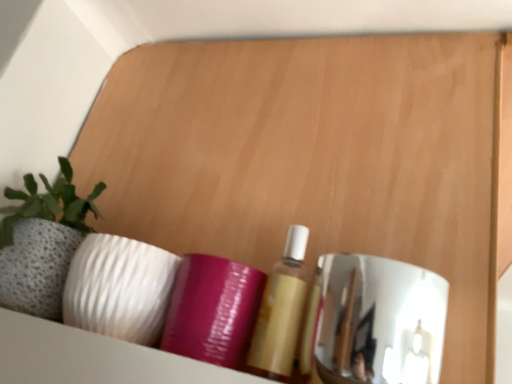
Question: Is matte gold bottle at center, marked as the second toiletry in a left-to-right arrangement, wider or thinner than purple glossy tube at center, positioned as the 1th toiletry in left-to-right order?

Choices:
 (A) thin
 (B) wide

Answer: (A)

Question: From a real-world perspective, is matte gold bottle at center, positioned as the first toiletry in right-to-left order, physically located above or below purple glossy tube at center, the second toiletry when ordered from right to left?

Choices:
 (A) below
 (B) above

Answer: (B)

Question: Considering the real-world distances, which object is closest to the matte gold bottle at center, positioned as the first toiletry in right-to-left order?

Choices:
 (A) textured stone planter at left
 (B) polished chrome mirror at right
 (C) purple glossy tube at center, positioned as the 1th toiletry in left-to-right order

Answer: (C)

Question: Which is nearer to the polished chrome mirror at right?

Choices:
 (A) purple glossy tube at center, positioned as the 1th toiletry in left-to-right order
 (B) textured stone planter at left
 (C) matte gold bottle at center, positioned as the first toiletry in right-to-left order

Answer: (C)